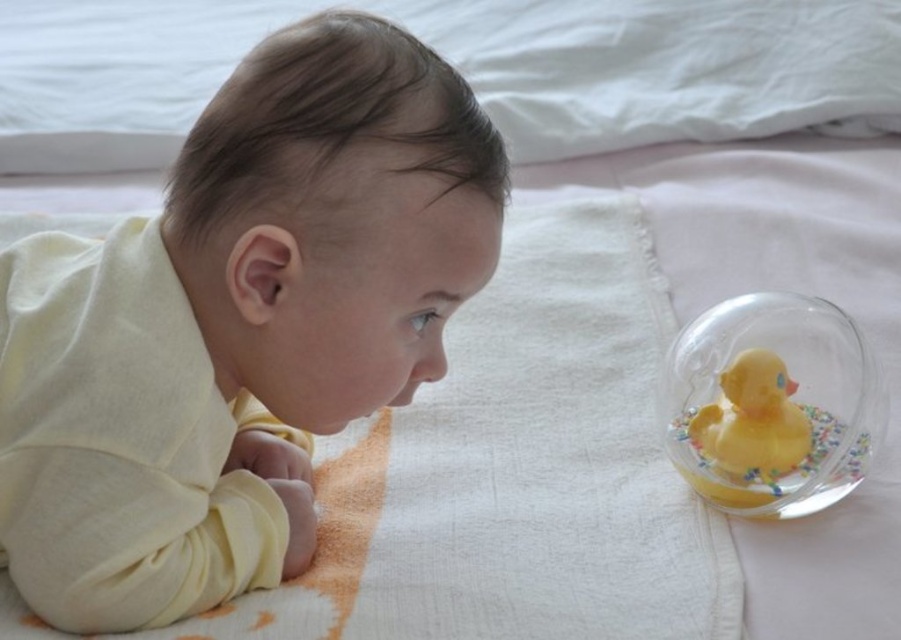
Does transparent glass bowl at right have a lesser width compared to yellow rubber duck at right?

No.

Is point (777, 445) in front of point (779, 401)?

Yes.

Locate an element on the screen. This screenshot has width=901, height=640. transparent glass bowl at right is located at coordinates (771, 404).

Between point (111, 285) and point (766, 422), which one is positioned behind?

The point (766, 422) is more distant.

Can you confirm if soft yellow fabric at center is taller than yellow rubber duck at right?

Yes.

Measure the distance between point (320, 65) and camera.

Point (320, 65) and camera are 76.89 centimeters apart from each other.

At what (x,y) coordinates should I click in order to perform the action: click on soft yellow fabric at center. Please return your answer as a coordinate pair (x, y). The height and width of the screenshot is (640, 901). Looking at the image, I should click on (238, 324).

Does soft yellow fabric at center have a greater width compared to transparent glass bowl at right?

Yes, soft yellow fabric at center is wider than transparent glass bowl at right.

Measure the distance between soft yellow fabric at center and transparent glass bowl at right.

soft yellow fabric at center and transparent glass bowl at right are 18.37 inches apart.

Image resolution: width=901 pixels, height=640 pixels. I want to click on soft yellow fabric at center, so click(x=238, y=324).